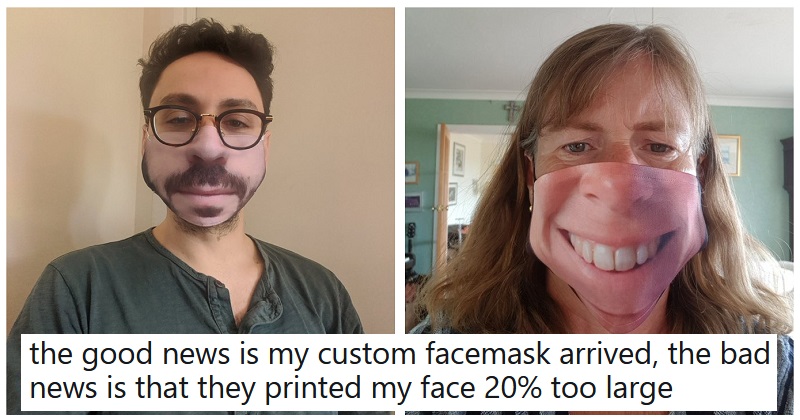
Find the location of `green wall`. green wall is located at coordinates (770, 180).